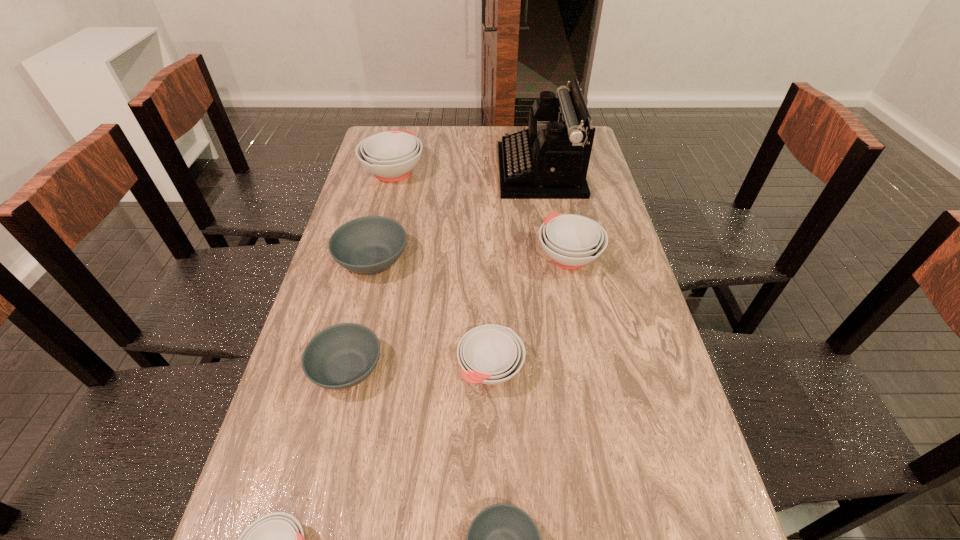
This screenshot has height=540, width=960. Identify the location of vacant area that lies between the farthest white soup bowl and the rightmost soup bowl. (481, 214).

Identify which object is the third closest to the biggest gray soup bowl. Please provide its 2D coordinates. Your answer should be formatted as a tuple, i.e. [(x, y)], where the tuple contains the x and y coordinates of a point satisfying the conditions above.

[(391, 155)]

Find the location of a particular element. object that stands as the sixth closest to the second smallest white soup bowl is located at coordinates (549, 160).

At what (x,y) coordinates should I click in order to perform the action: click on soup bowl that is the third closest to the farthest soup bowl. Please return your answer as a coordinate pair (x, y). Looking at the image, I should click on (341, 356).

You are a GUI agent. You are given a task and a screenshot of the screen. Output one action in this format:
    pyautogui.click(x=<x>, y=<y>)
    Task: Click on the third closest soup bowl to the tallest object
    
    Given the screenshot: What is the action you would take?
    pyautogui.click(x=368, y=245)

Where is `white soup bowl that is the second closest one to the third biggest white soup bowl`? white soup bowl that is the second closest one to the third biggest white soup bowl is located at coordinates (276, 539).

Identify which white soup bowl is located as the third nearest to the rightmost soup bowl. Please provide its 2D coordinates. Your answer should be formatted as a tuple, i.e. [(x, y)], where the tuple contains the x and y coordinates of a point satisfying the conditions above.

[(276, 539)]

Choose which gray soup bowl is the second nearest neighbor to the second nearest gray soup bowl. Please provide its 2D coordinates. Your answer should be formatted as a tuple, i.e. [(x, y)], where the tuple contains the x and y coordinates of a point satisfying the conditions above.

[(502, 539)]

Select which gray soup bowl is the closest to the farthest gray soup bowl. Please provide its 2D coordinates. Your answer should be formatted as a tuple, i.e. [(x, y)], where the tuple contains the x and y coordinates of a point satisfying the conditions above.

[(341, 356)]

You are a GUI agent. You are given a task and a screenshot of the screen. Output one action in this format:
    pyautogui.click(x=<x>, y=<y>)
    Task: Click on the free space that satisfies the following two spatial constraints: 1. on the typing side of the black typewriter; 2. on the front side of the farthest gray soup bowl
    
    Given the screenshot: What is the action you would take?
    pyautogui.click(x=556, y=260)